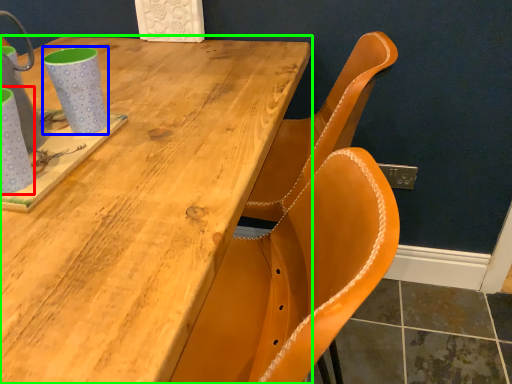
Question: Considering the real-world distances, which object is closest to mug (highlighted by a red box)? mug (highlighted by a blue box) or table (highlighted by a green box).

Choices:
 (A) mug
 (B) table

Answer: (A)